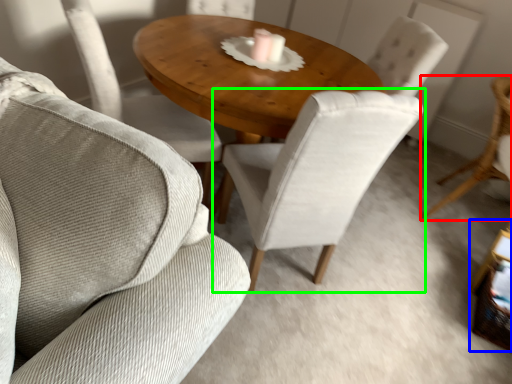
Question: Which is farther away from chair (highlighted by a red box)? side table (highlighted by a blue box) or chair (highlighted by a green box)?

Choices:
 (A) side table
 (B) chair

Answer: (B)